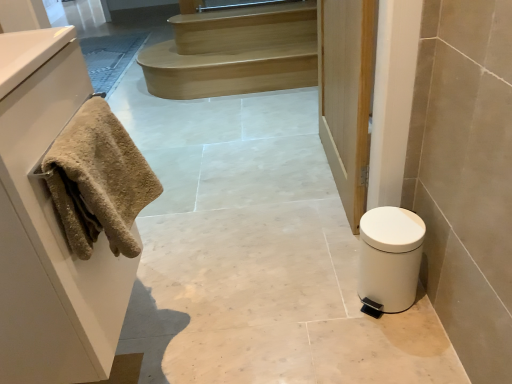
Question: Is the position of wooden door at center more distant than that of white matte trash can at lower right?

Choices:
 (A) no
 (B) yes

Answer: (B)

Question: Does wooden door at center have a smaller size compared to white matte trash can at lower right?

Choices:
 (A) yes
 (B) no

Answer: (B)

Question: Considering the relative sizes of wooden door at center and white matte trash can at lower right in the image provided, is wooden door at center taller than white matte trash can at lower right?

Choices:
 (A) no
 (B) yes

Answer: (B)

Question: Is wooden door at center next to white matte trash can at lower right and touching it?

Choices:
 (A) yes
 (B) no

Answer: (B)

Question: From a real-world perspective, is wooden door at center below white matte trash can at lower right?

Choices:
 (A) no
 (B) yes

Answer: (A)

Question: Does wooden door at center have a lesser height compared to white matte trash can at lower right?

Choices:
 (A) yes
 (B) no

Answer: (B)

Question: From a real-world perspective, is light brown wooden stairs at upper center located higher than white matte trash can at lower right?

Choices:
 (A) no
 (B) yes

Answer: (B)

Question: Is light brown wooden stairs at upper center bigger than white matte trash can at lower right?

Choices:
 (A) yes
 (B) no

Answer: (A)

Question: Considering the relative sizes of light brown wooden stairs at upper center and white matte trash can at lower right in the image provided, is light brown wooden stairs at upper center smaller than white matte trash can at lower right?

Choices:
 (A) no
 (B) yes

Answer: (A)

Question: Is light brown wooden stairs at upper center turned away from white matte trash can at lower right?

Choices:
 (A) yes
 (B) no

Answer: (B)

Question: Considering the relative positions of light brown wooden stairs at upper center and white matte trash can at lower right in the image provided, is light brown wooden stairs at upper center to the left of white matte trash can at lower right from the viewer's perspective?

Choices:
 (A) yes
 (B) no

Answer: (A)

Question: Considering the relative sizes of light brown wooden stairs at upper center and white matte trash can at lower right in the image provided, is light brown wooden stairs at upper center shorter than white matte trash can at lower right?

Choices:
 (A) no
 (B) yes

Answer: (B)

Question: From a real-world perspective, is white matte trash can at lower right positioned over beige textured towel at left based on gravity?

Choices:
 (A) no
 (B) yes

Answer: (A)